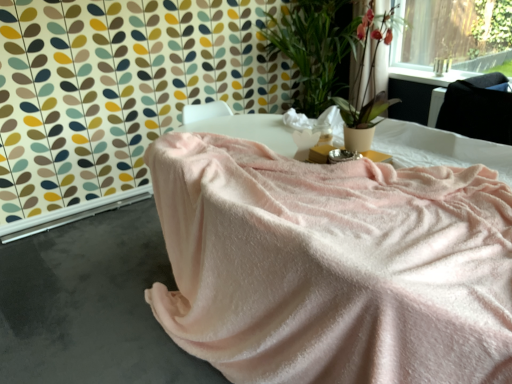
In order to click on pink soft fabric at center in this screenshot , I will do `click(332, 266)`.

The height and width of the screenshot is (384, 512). What do you see at coordinates (332, 266) in the screenshot? I see `pink soft fabric at center` at bounding box center [332, 266].

Identify the location of satin black at upper right. (478, 108).

Where is `pink fabric at upper right`? This screenshot has width=512, height=384. pink fabric at upper right is located at coordinates (369, 61).

In the scene shown: Does pink soft fabric at lower left have a larger size compared to pink soft fabric at center?

Actually, pink soft fabric at lower left might be smaller than pink soft fabric at center.

Is pink soft fabric at lower left facing towards pink soft fabric at center?

No, pink soft fabric at lower left does not turn towards pink soft fabric at center.

From the image's perspective, is pink soft fabric at lower left under pink soft fabric at center?

Yes.

Who is taller, pink soft fabric at lower left or satin black at upper right?

Standing taller between the two is satin black at upper right.

Is pink soft fabric at lower left touching satin black at upper right?

pink soft fabric at lower left and satin black at upper right are not in contact.

From the image's perspective, is pink soft fabric at lower left located beneath satin black at upper right?

Yes.

Is pink soft fabric at lower left to the right of satin black at upper right from the viewer's perspective?

No.

Is pink soft fabric at center oriented towards satin black at upper right?

No, pink soft fabric at center does not turn towards satin black at upper right.

From the image's perspective, which one is positioned higher, pink soft fabric at center or satin black at upper right?

satin black at upper right appears higher in the image.

Is satin black at upper right completely or partially inside pink soft fabric at center?

Actually, satin black at upper right is outside pink soft fabric at center.

Which object is thinner, pink soft fabric at center or satin black at upper right?

With smaller width is satin black at upper right.

Between pink fabric at upper right and pink soft fabric at center, which one has smaller size?

With smaller size is pink fabric at upper right.

Which object is closer to the camera, pink fabric at upper right or pink soft fabric at center?

pink soft fabric at center is in front.

Is pink soft fabric at center inside pink fabric at upper right?

No, pink fabric at upper right does not contain pink soft fabric at center.

Would you consider pink fabric at upper right to be distant from pink soft fabric at center?

No, pink fabric at upper right is not far away from pink soft fabric at center.

From the image's perspective, is pink soft fabric at center located above pink fabric at upper right?

Actually, pink soft fabric at center appears below pink fabric at upper right in the image.

Based on the photo, which object is closer to the camera, pink soft fabric at center or pink fabric at upper right?

pink soft fabric at center is in front.

Is point (498, 195) positioned before point (369, 67)?

Yes, it is.

Considering the sizes of pink soft fabric at center and pink fabric at upper right in the image, is pink soft fabric at center bigger or smaller than pink fabric at upper right?

Considering their sizes, pink soft fabric at center takes up more space than pink fabric at upper right.

Considering the positions of point (437, 273) and point (345, 85), is point (437, 273) closer or farther from the camera than point (345, 85)?

Clearly, point (437, 273) is closer to the camera than point (345, 85).

Is pink soft fabric at center facing away from green leafy plant at upper right?

Absolutely, pink soft fabric at center is directed away from green leafy plant at upper right.

Is pink soft fabric at lower left aimed at green leafy plant at upper right?

No, pink soft fabric at lower left does not turn towards green leafy plant at upper right.

Considering their positions, is pink soft fabric at lower left located in front of or behind green leafy plant at upper right?

pink soft fabric at lower left is in front of green leafy plant at upper right.

From a real-world perspective, is pink soft fabric at lower left under green leafy plant at upper right?

Yes, from a real-world perspective, pink soft fabric at lower left is beneath green leafy plant at upper right.

Is pink soft fabric at lower left beside green leafy plant at upper right?

pink soft fabric at lower left is not next to green leafy plant at upper right, and they're not touching.

Identify the location of furniture above the pink soft fabric at lower left (from the image's perspective). The height and width of the screenshot is (384, 512). (332, 266).

Find the location of a particular element. The image size is (512, 384). concrete that appears in front of the satin black at upper right is located at coordinates (90, 305).

Considering their positions, is satin black at upper right positioned closer to pink soft fabric at lower left than pink fabric at upper right?

pink fabric at upper right is closer to pink soft fabric at lower left.

Looking at the image, which one is located closer to pink fabric at upper right, satin black at upper right or pink soft fabric at center?

satin black at upper right lies closer to pink fabric at upper right than the other object.

Based on their spatial positions, is pink soft fabric at center or satin black at upper right closer to green leafy plant at upper right?

satin black at upper right is positioned closer to the anchor green leafy plant at upper right.

Estimate the real-world distances between objects in this image. Which object is closer to pink soft fabric at center, satin black at upper right or green leafy plant at upper right?

satin black at upper right is positioned closer to the anchor pink soft fabric at center.

From the picture: When comparing their distances from satin black at upper right, does green leafy plant at upper right or pink fabric at upper right seem closer?

Among the two, pink fabric at upper right is located nearer to satin black at upper right.

Looking at this image, looking at the image, which one is located further to green leafy plant at upper right, pink soft fabric at center or pink fabric at upper right?

pink soft fabric at center lies further to green leafy plant at upper right than the other object.

Estimate the real-world distances between objects in this image. Which object is closer to pink soft fabric at center, satin black at upper right or pink fabric at upper right?

Based on the image, pink fabric at upper right appears to be nearer to pink soft fabric at center.

Estimate the real-world distances between objects in this image. Which object is closer to pink soft fabric at center, green leafy plant at upper right or pink fabric at upper right?

Among the two, pink fabric at upper right is located nearer to pink soft fabric at center.

Image resolution: width=512 pixels, height=384 pixels. I want to click on satin between pink soft fabric at center and green leafy plant at upper right in the front-back direction, so click(478, 108).

Locate an element on the screen. Image resolution: width=512 pixels, height=384 pixels. satin between pink soft fabric at center and pink fabric at upper right from front to back is located at coordinates (478, 108).

Find the location of a particular element. houseplant between pink soft fabric at lower left and pink fabric at upper right from front to back is located at coordinates (323, 47).

Where is `houseplant between pink soft fabric at center and pink fabric at upper right from front to back`? houseplant between pink soft fabric at center and pink fabric at upper right from front to back is located at coordinates (323, 47).